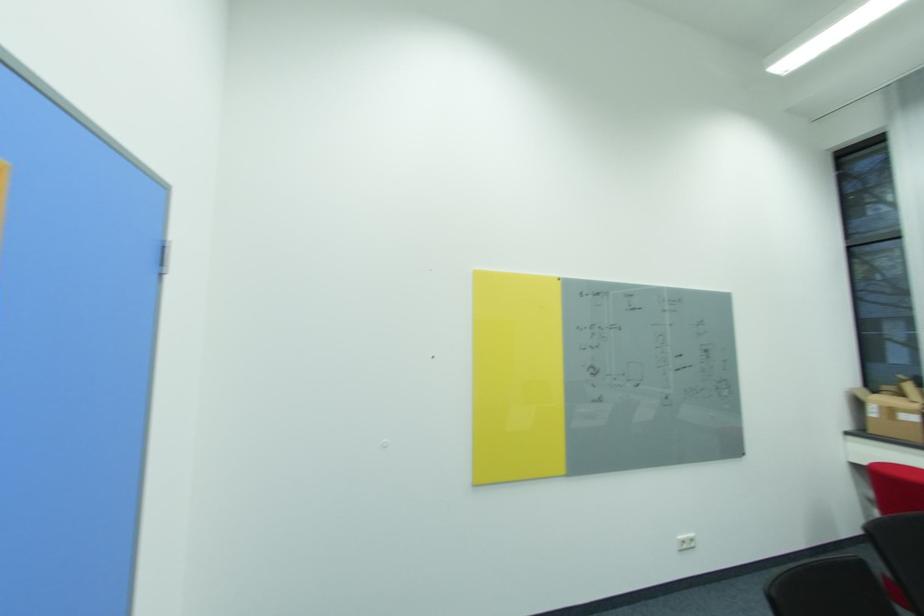
Where would you plugg the white power outlet? Please return your answer as a coordinate pair (x, y).

(686, 541)